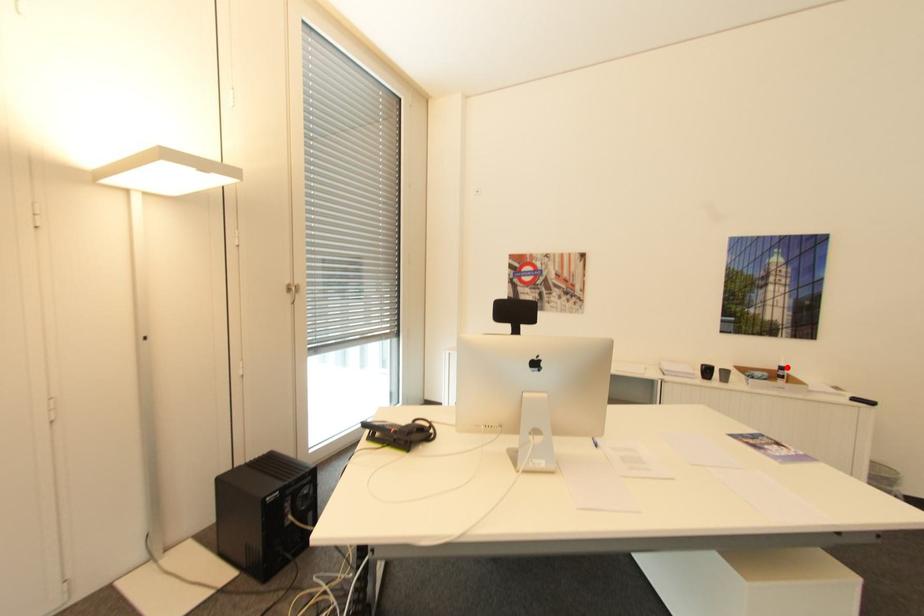
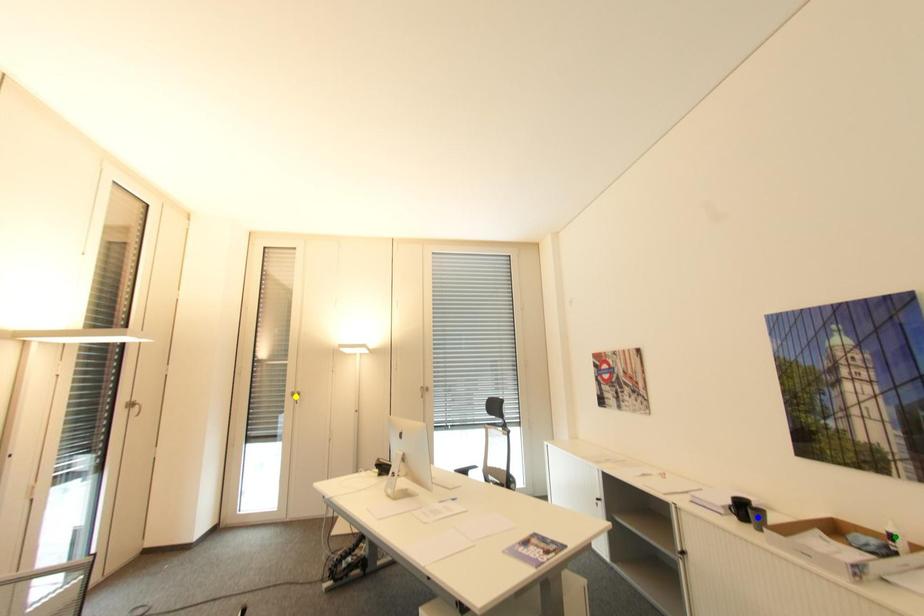
Question: I am providing you with two images of the same scene from different viewpoints. A red point is marked on the first image. You are given multiple points on the second image. Can you choose the point in image 2 that corresponds to the point in image 1?

Choices:
 (A) blue point
 (B) green point
 (C) yellow point

Answer: (B)